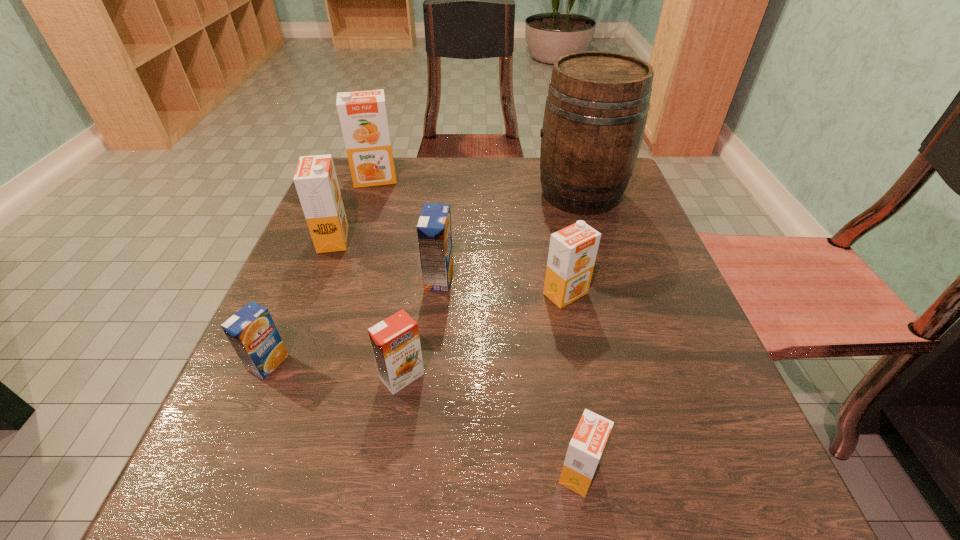
The width and height of the screenshot is (960, 540). What are the coordinates of `the nearer blue orange_juice` in the screenshot? It's located at (252, 332).

You are a GUI agent. You are given a task and a screenshot of the screen. Output one action in this format:
    pyautogui.click(x=<x>, y=<y>)
    Task: Click on the nearest orange orange juice
    
    Given the screenshot: What is the action you would take?
    pyautogui.click(x=585, y=449)

This screenshot has width=960, height=540. What are the coordinates of `the nearest object` in the screenshot? It's located at (585, 449).

Image resolution: width=960 pixels, height=540 pixels. I want to click on vacant point located 0.170m on the side of the cider near the bung hole, so click(464, 193).

You are a GUI agent. You are given a task and a screenshot of the screen. Output one action in this format:
    pyautogui.click(x=<x>, y=<y>)
    Task: Click on the vacant space located 0.400m on the side of the cider near the bung hole
    
    Given the screenshot: What is the action you would take?
    pyautogui.click(x=367, y=193)

Image resolution: width=960 pixels, height=540 pixels. I want to click on free space located on the side of the cider near the bung hole, so click(x=471, y=193).

Find the location of a particular element. vacant space located 0.200m on the right of the biggest orange orange juice is located at coordinates (478, 179).

Identify the location of blank space located 0.090m on the front of the sixth shortest orange juice. This screenshot has height=540, width=960. (316, 285).

Where is `vacant space located 0.310m on the left of the third biggest orange orange juice`? vacant space located 0.310m on the left of the third biggest orange orange juice is located at coordinates (372, 293).

Where is `free region located 0.310m on the front of the bigger blue orange_juice`? free region located 0.310m on the front of the bigger blue orange_juice is located at coordinates (421, 458).